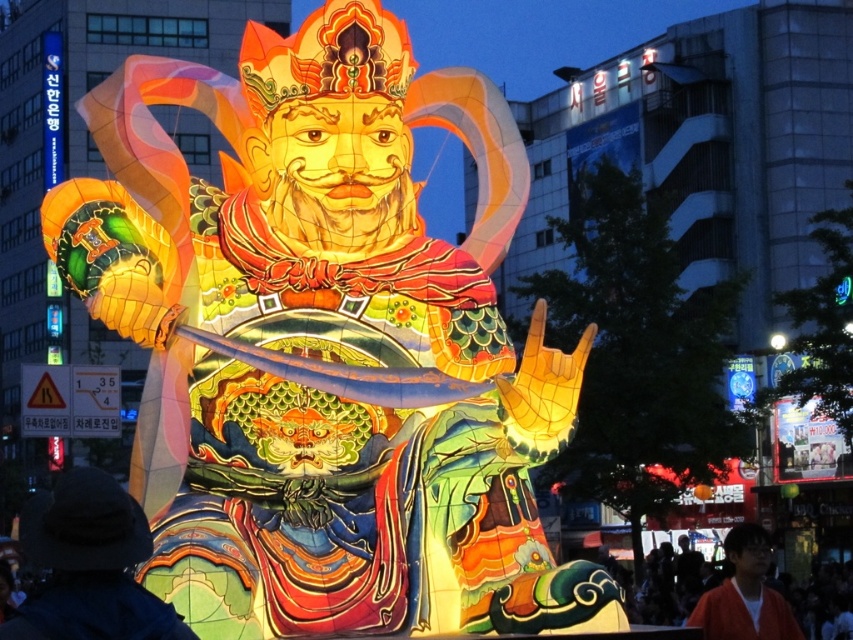
You are an artist trying to paint the lantern scene. You need to decide which object to paint first based on their sizes. Which object should you start with, the dark blue fabric hat at lower left or the orange fabric shirt at lower right?

The dark blue fabric hat at lower left is bigger than the orange fabric shirt at lower right, so you should start with the dark blue fabric hat at lower left since larger objects are often painted first to establish the composition.

You are an artist trying to sketch the scene. You notice the dark blue fabric hat at lower left and the orange fabric shirt at lower right on the lantern. Which object should you draw first if you want to start with the taller one?

The orange fabric shirt at lower right is taller than the dark blue fabric hat at lower left, so you should draw the orange fabric shirt at lower right first.